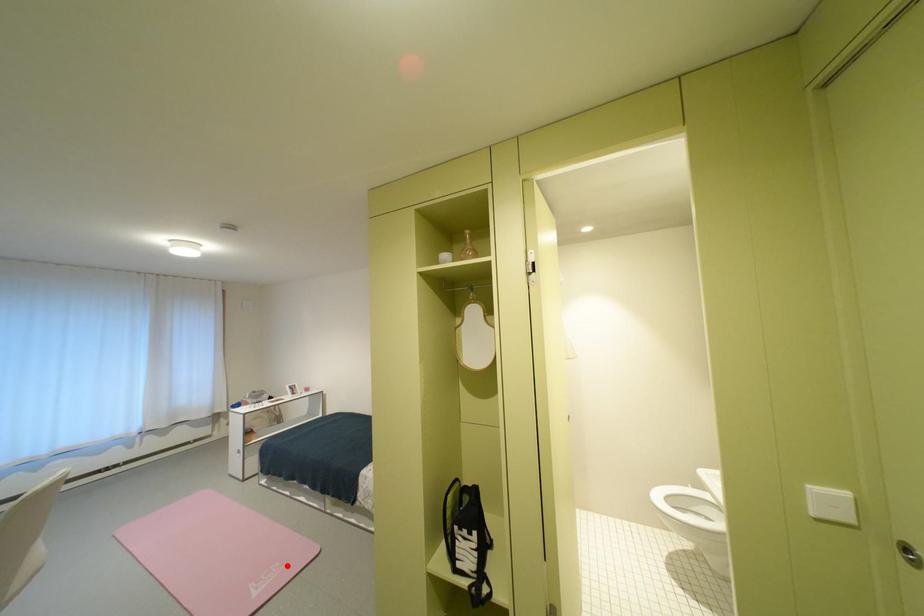
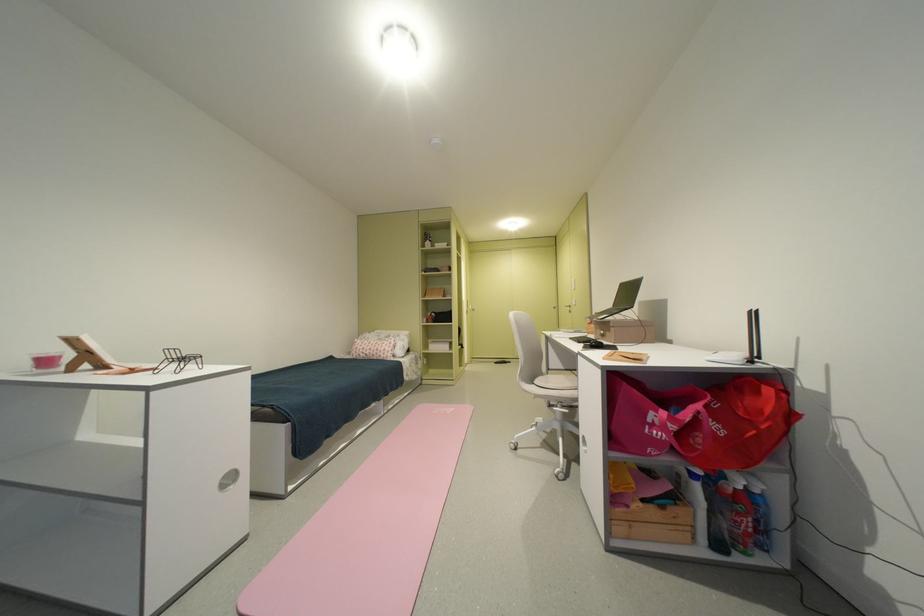
Locate, in the second image, the point that corresponds to the highlighted location in the first image.

(444, 413)